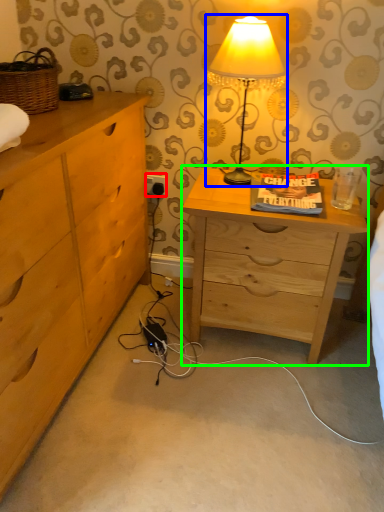
Question: Which object is positioned farthest from electric outlet (highlighted by a red box)? Select from lamp (highlighted by a blue box) and nightstand (highlighted by a green box).

Choices:
 (A) lamp
 (B) nightstand

Answer: (B)